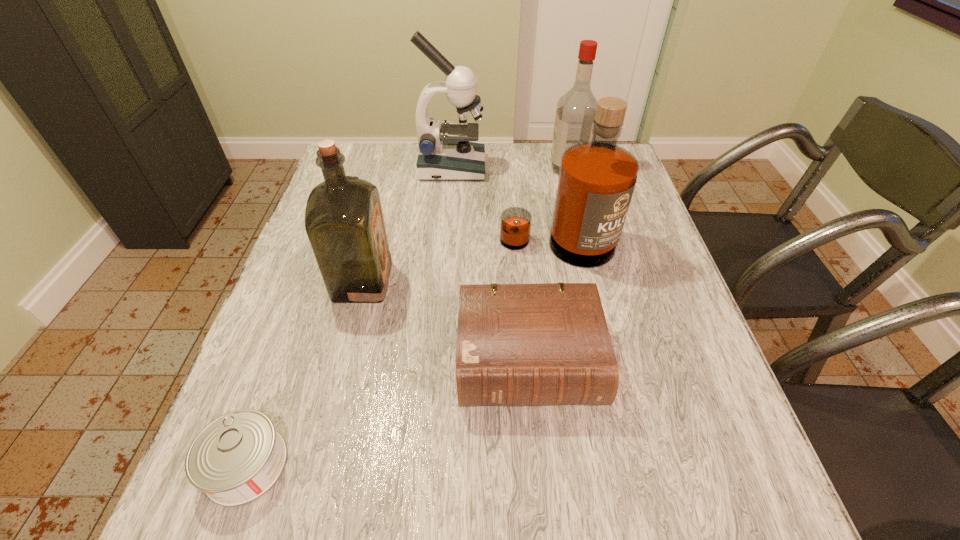
Identify the location of microscope. (445, 153).

The height and width of the screenshot is (540, 960). In order to click on the farthest liquor in this screenshot , I will do `click(576, 109)`.

This screenshot has width=960, height=540. I want to click on the leftmost liquor, so click(344, 222).

You are a GUI agent. You are given a task and a screenshot of the screen. Output one action in this format:
    pyautogui.click(x=<x>, y=<y>)
    Task: Click on the fifth tallest object
    The width and height of the screenshot is (960, 540).
    Given the screenshot: What is the action you would take?
    pyautogui.click(x=545, y=344)

At what (x,y) coordinates should I click in order to perform the action: click on the fifth farthest object. Please return your answer as a coordinate pair (x, y). This screenshot has height=540, width=960. Looking at the image, I should click on (545, 344).

Locate an element on the screen. the nearest object is located at coordinates (235, 459).

The height and width of the screenshot is (540, 960). Identify the location of the shortest object. (235, 459).

Where is `vacant space located 0.090m at the eyepiece of the microscope`? vacant space located 0.090m at the eyepiece of the microscope is located at coordinates (514, 168).

Where is `vacant position located on the front-facing side of the farthest liquor`? The width and height of the screenshot is (960, 540). vacant position located on the front-facing side of the farthest liquor is located at coordinates (425, 168).

You are a GUI agent. You are given a task and a screenshot of the screen. Output one action in this format:
    pyautogui.click(x=<x>, y=<y>)
    Task: Click on the free location located on the front-facing side of the farthest liquor
    The height and width of the screenshot is (540, 960).
    Given the screenshot: What is the action you would take?
    pyautogui.click(x=461, y=168)